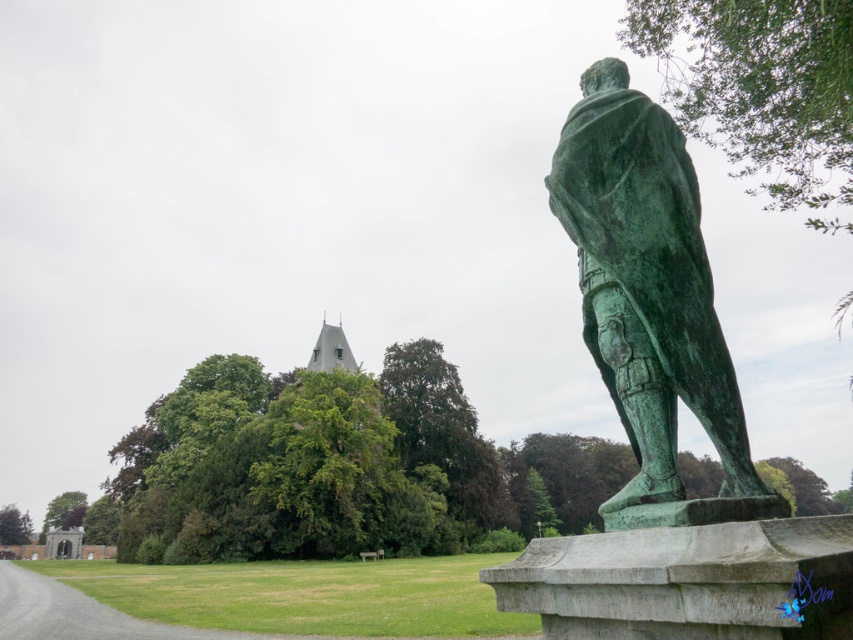
Question: In this image, where is green patina statue at right located relative to gray stone spire at upper center?

Choices:
 (A) above
 (B) below

Answer: (A)

Question: Can you confirm if green patina statue at right is thinner than gray stone spire at upper center?

Choices:
 (A) no
 (B) yes

Answer: (B)

Question: Which point is farther to the camera?

Choices:
 (A) (317, 369)
 (B) (653, 259)

Answer: (A)

Question: Is green patina statue at right wider than gray stone spire at upper center?

Choices:
 (A) yes
 (B) no

Answer: (B)

Question: Which point appears farthest from the camera in this image?

Choices:
 (A) (343, 362)
 (B) (613, 518)

Answer: (A)

Question: Among these objects, which one is farthest from the camera?

Choices:
 (A) green patina statue at right
 (B) gray stone spire at upper center

Answer: (B)